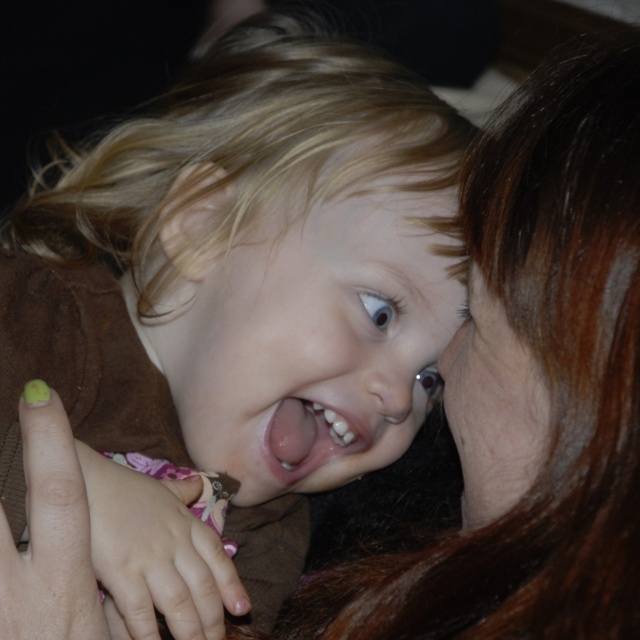
Is smooth skin face at center taller than pink flesh-colored tongue at center?

Correct, smooth skin face at center is much taller as pink flesh-colored tongue at center.

Who is more forward, (381,252) or (358,445)?

Point (381,252) is in front.

Measure the distance between point (x=321, y=426) and camera.

They are 67.13 centimeters apart.

Where is `smooth skin face at center`? smooth skin face at center is located at coordinates (316, 342).

Can you confirm if blonde hair at center is shorter than pink flesh-colored tongue at center?

In fact, blonde hair at center may be taller than pink flesh-colored tongue at center.

Is blonde hair at center thinner than pink flesh-colored tongue at center?

No, blonde hair at center is not thinner than pink flesh-colored tongue at center.

Locate an element on the screen. The height and width of the screenshot is (640, 640). blonde hair at center is located at coordinates (244, 269).

Can you confirm if blonde hair at center is taller than smooth skin face at center?

Correct, blonde hair at center is much taller as smooth skin face at center.

Does blonde hair at center have a larger size compared to smooth skin face at center?

Correct, blonde hair at center is larger in size than smooth skin face at center.

This screenshot has width=640, height=640. What do you see at coordinates (244, 269) in the screenshot? I see `blonde hair at center` at bounding box center [244, 269].

I want to click on blonde hair at center, so click(x=244, y=269).